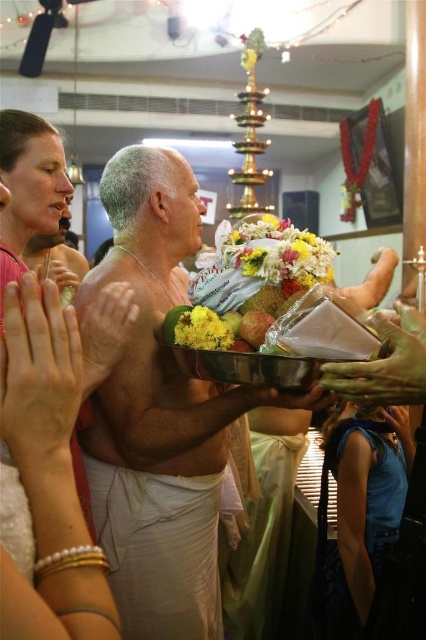
Question: Which of the following is the closest to the observer?

Choices:
 (A) (138, 294)
 (B) (241, 596)

Answer: (A)

Question: Can you confirm if green silk robe at lower right is positioned to the right of floral bouquet at center?

Choices:
 (A) no
 (B) yes

Answer: (A)

Question: Which of the following is the closest to the observer?

Choices:
 (A) pink fabric at upper left
 (B) floral bouquet at center
 (C) blue fabric robe at lower right

Answer: (A)

Question: Can you confirm if white cloth at center is smaller than yellow matte flower at center?

Choices:
 (A) yes
 (B) no

Answer: (B)

Question: Among these objects, which one is farthest from the camera?

Choices:
 (A) green silk robe at lower right
 (B) white clothed man at center
 (C) floral bouquet at center

Answer: (A)

Question: Observing the image, what is the correct spatial positioning of white clothed man at center in reference to pink fabric at upper left?

Choices:
 (A) left
 (B) right

Answer: (B)